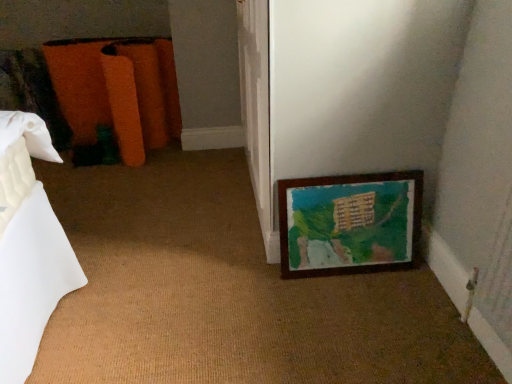
Find the location of `vacant space in front of wooden picture frame at lower right`. vacant space in front of wooden picture frame at lower right is located at coordinates (362, 317).